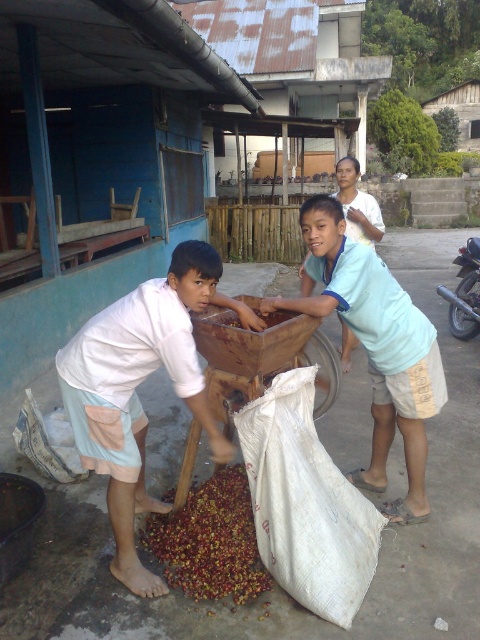
You are observing the scene from a distance. There is a white cotton shirt at left and a light blue shirt at right. Which shirt is closer to the center of the image?

The white cotton shirt at left is closer to the center of the image because its coordinates are at point (x=136, y=385), which places it nearer to the center compared to the light blue shirt at right.

You are a farmer who needs to determine which item is larger between the red matte coffee beans at lower center and the brown matte food at center. Which one should you choose?

The red matte coffee beans at lower center is bigger than the brown matte food at center, so you should choose the red matte coffee beans at lower center.